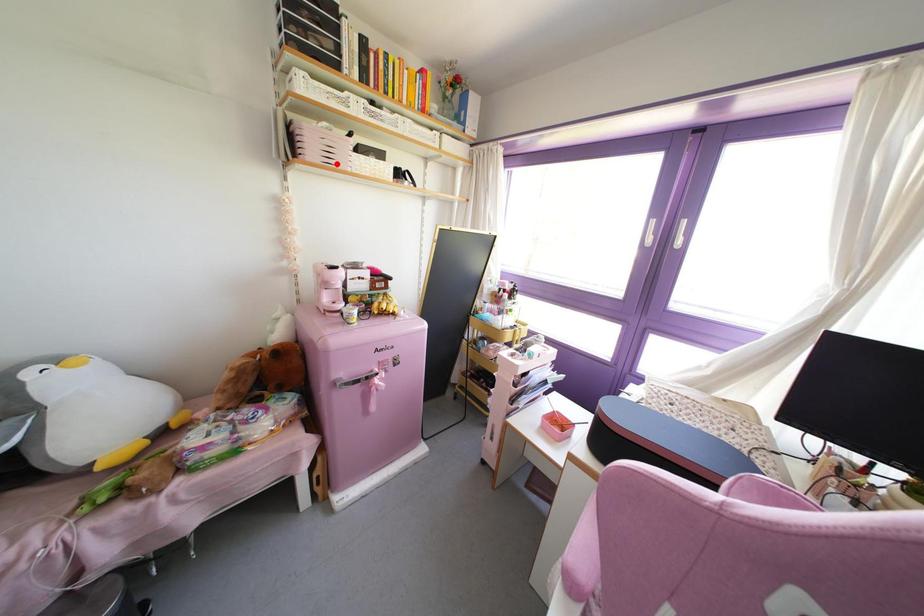
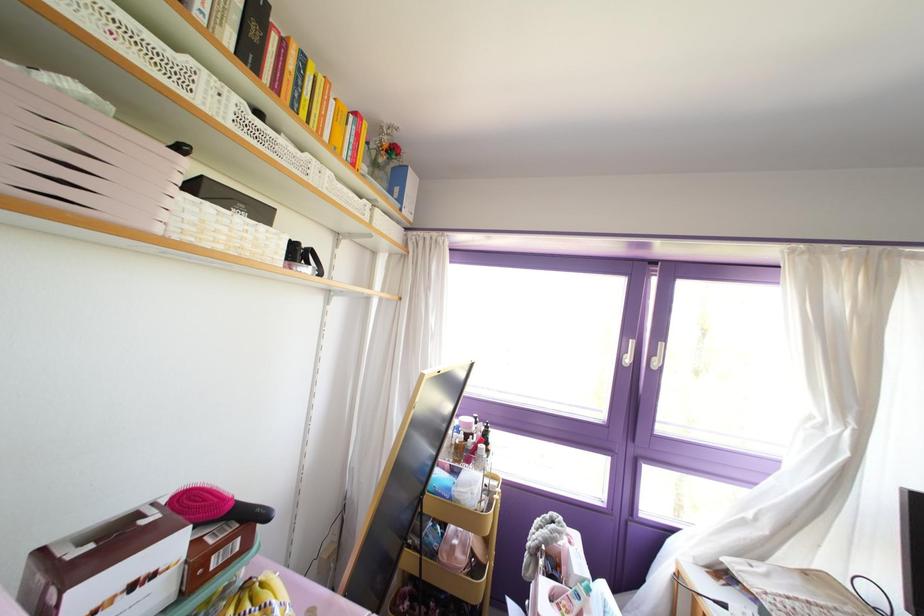
The point at the highlighted location is marked in the first image. Where is the corresponding point in the second image?

(107, 208)